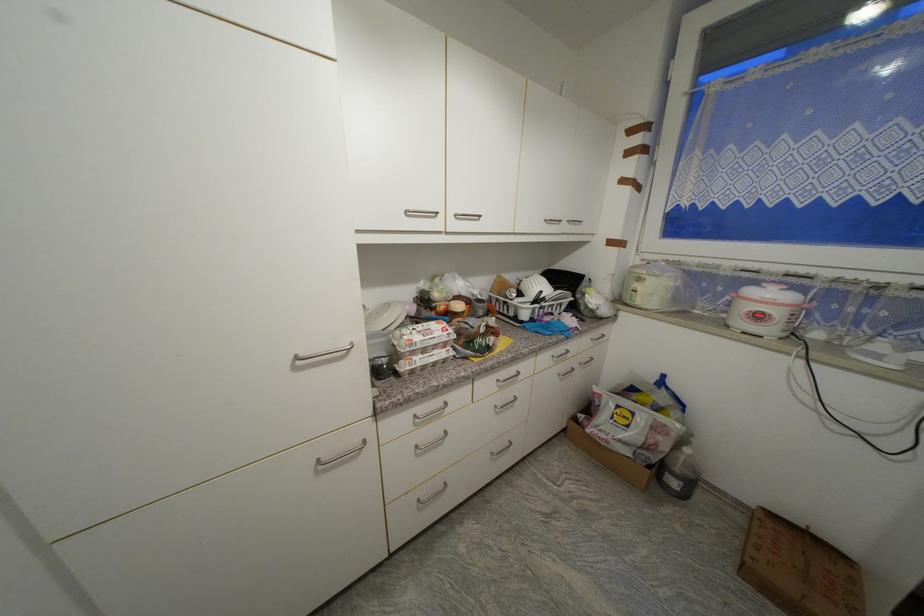
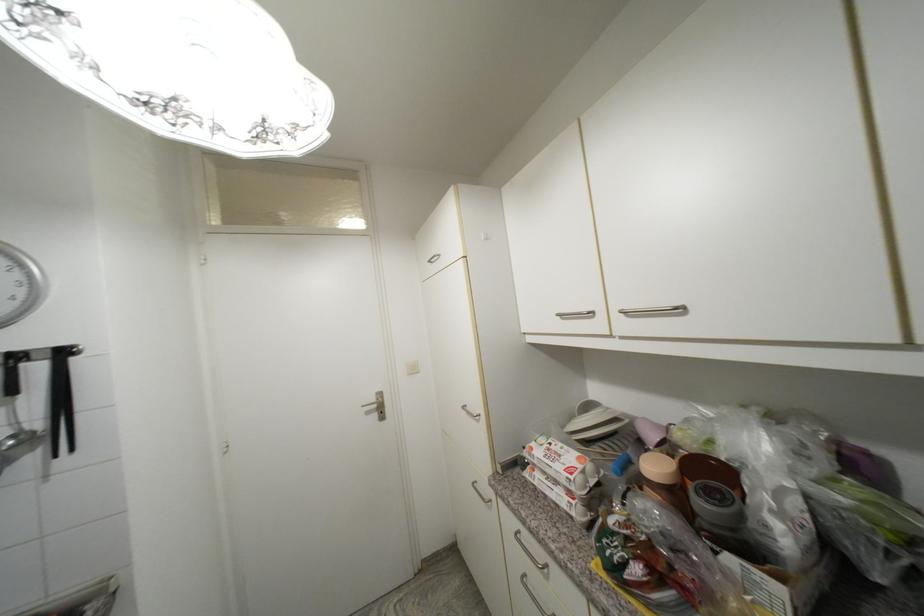
The point at (453, 276) is marked in the first image. Where is the corresponding point in the second image?

(730, 410)